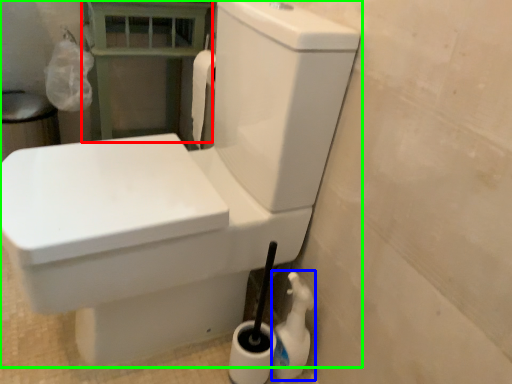
Question: Estimate the real-world distances between objects in this image. Which object is closer to balustrade (highlighted by a red box), cleaning product (highlighted by a blue box) or toilet (highlighted by a green box)?

Choices:
 (A) cleaning product
 (B) toilet

Answer: (B)